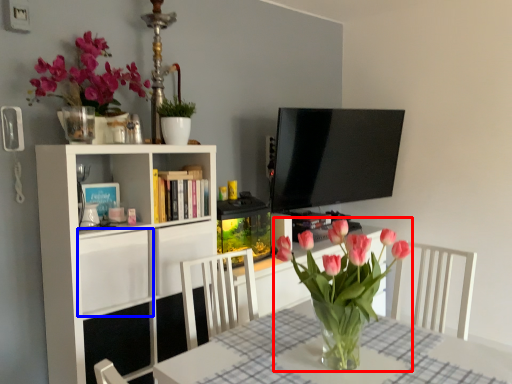
Question: Which object is closer to the camera taking this photo, floral arrangement (highlighted by a red box) or cabinet (highlighted by a blue box)?

Choices:
 (A) floral arrangement
 (B) cabinet

Answer: (A)